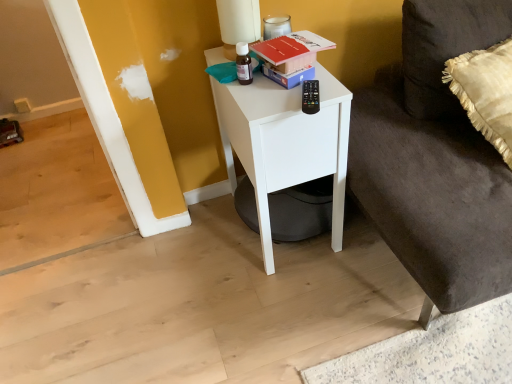
Identify the location of vacant region in front of white matte nightstand at center. point(298,311).